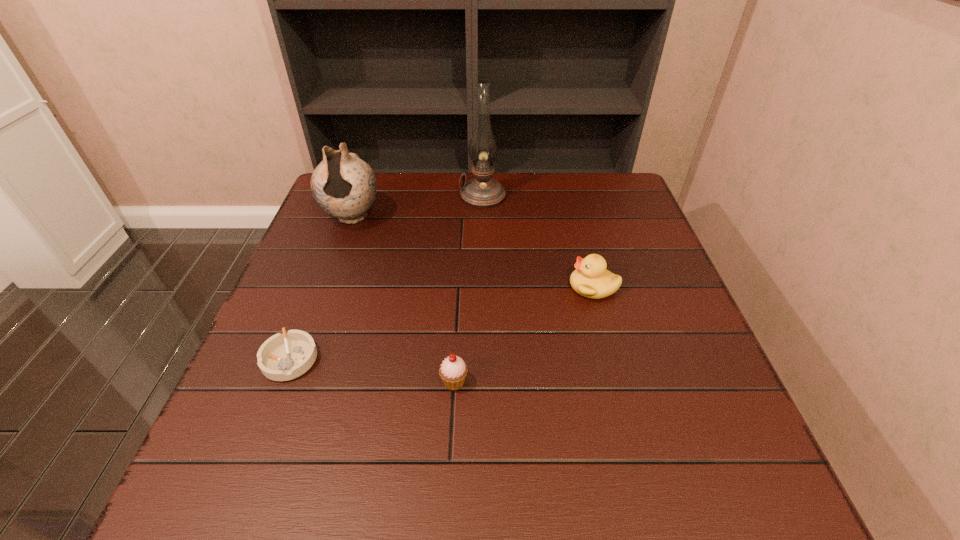
At what (x,y) coordinates should I click in order to perform the action: click on oil lamp. Please return your answer as a coordinate pair (x, y). The height and width of the screenshot is (540, 960). Looking at the image, I should click on [x=482, y=191].

Locate an element on the screen. The image size is (960, 540). pottery is located at coordinates (343, 185).

Identify the location of the third farthest object. This screenshot has width=960, height=540. (590, 279).

Where is `the rightmost object`? This screenshot has height=540, width=960. the rightmost object is located at coordinates (590, 279).

Image resolution: width=960 pixels, height=540 pixels. I want to click on cupcake, so click(x=453, y=370).

Find the location of `the shortest object`. the shortest object is located at coordinates (282, 357).

The image size is (960, 540). I want to click on vacant point located on the front of the tallest object, so click(483, 236).

This screenshot has height=540, width=960. Identify the location of free region located 0.230m from the spout of the pottery. (323, 295).

You are a GUI agent. You are given a task and a screenshot of the screen. Output one action in this format:
    pyautogui.click(x=<x>, y=<y>)
    Task: Click on the vacant space located on the front-facing side of the third nearest object
    
    Given the screenshot: What is the action you would take?
    pyautogui.click(x=482, y=286)

This screenshot has width=960, height=540. I want to click on free spot located 0.220m on the front-facing side of the third nearest object, so click(477, 286).